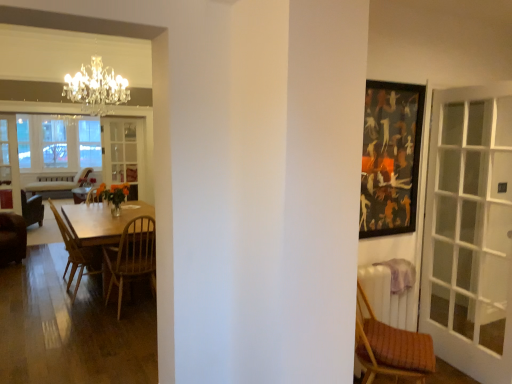
Find the location of a particular element. free space above dark wood picture frame at upper right (from a real-world perspective) is located at coordinates (390, 84).